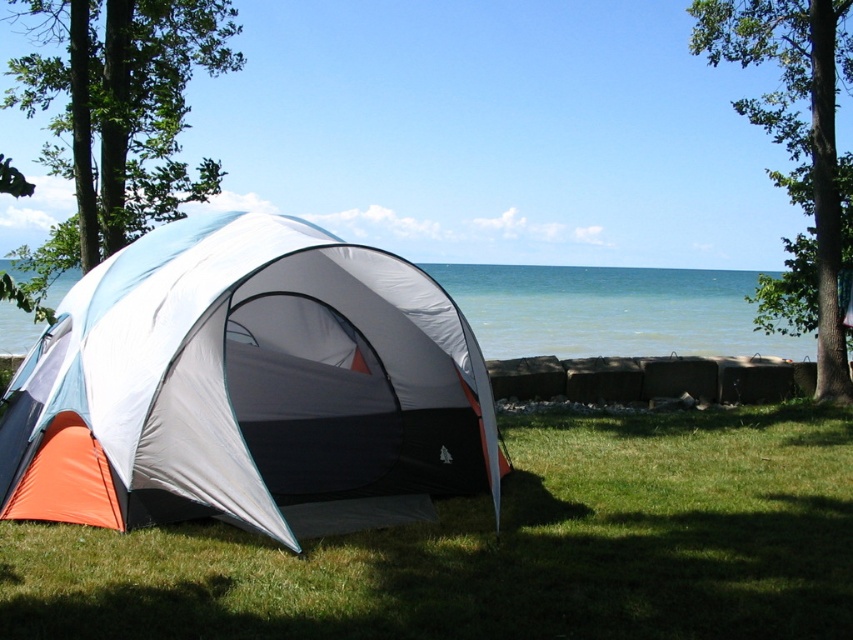
Between green grass at lower center and orange fabric tent at lower left, which one appears on the right side from the viewer's perspective?

Positioned to the right is green grass at lower center.

Is point (653, 560) more distant than point (490, 436)?

No.

Where is `green grass at lower center`? green grass at lower center is located at coordinates (503, 548).

Does blue water at center appear on the right side of green leafy tree at upper right?

No, blue water at center is not to the right of green leafy tree at upper right.

Is blue water at center to the left of green leafy tree at upper right from the viewer's perspective?

Yes, blue water at center is to the left of green leafy tree at upper right.

Who is more forward, (473, 296) or (817, 54)?

Positioned in front is point (817, 54).

I want to click on blue water at center, so click(x=611, y=310).

Who is more distant from viewer, (577,506) or (756,22)?

Positioned behind is point (756,22).

Which of these two, green grass at lower center or green leafy tree at upper right, stands taller?

green leafy tree at upper right is taller.

Which is in front, point (558, 451) or point (793, 257)?

Point (558, 451)

Where is `green grass at lower center`? green grass at lower center is located at coordinates (503, 548).